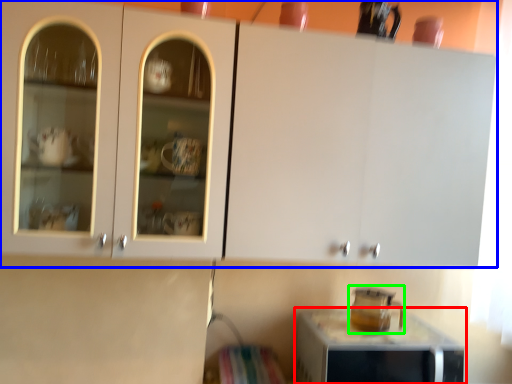
Question: Which object is positioned closest to home appliance (highlighted by a red box)? Select from cabinetry (highlighted by a blue box) and appliance (highlighted by a green box).

Choices:
 (A) cabinetry
 (B) appliance

Answer: (B)